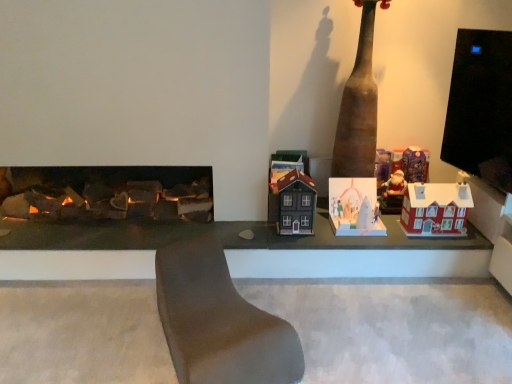
Question: Would you say brown matte totem pole at center is inside or outside red matte house at right, arranged as the 4th toy when viewed from the left?

Choices:
 (A) inside
 (B) outside

Answer: (B)

Question: In terms of height, does brown matte totem pole at center look taller or shorter compared to red matte house at right, arranged as the 4th toy when viewed from the left?

Choices:
 (A) short
 (B) tall

Answer: (B)

Question: Which is nearer to the brown leather couch at center?

Choices:
 (A) white paper house at center, arranged as the 2th toy when viewed from the left
 (B) red matte house at right, the first toy positioned from the right
 (C) shiny purple wrapping paper at upper right, positioned as the 2th toy in right-to-left order
 (D) brown matte totem pole at center
 (E) matte brown house at center, the 1th toy from the left

Answer: (E)

Question: Which of these objects is positioned closest to the brown matte totem pole at center?

Choices:
 (A) brown leather couch at center
 (B) matte brown house at center, the 1th toy from the left
 (C) red matte house at right, the first toy positioned from the right
 (D) shiny purple wrapping paper at upper right, positioned as the 2th toy in right-to-left order
 (E) white paper house at center, arranged as the 2th toy when viewed from the left

Answer: (E)